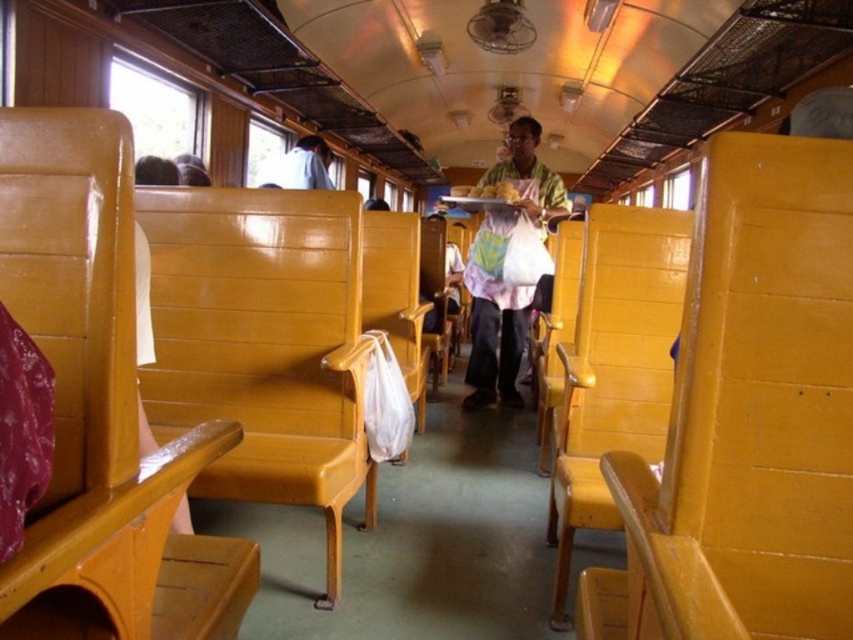
You are a passenger on this vintage train carriage and need to find a place to put your backpack. You see a matte wood chair at left and a matte green shirt at center. Which object has more space available to place your backpack?

The matte green shirt at center has more space available to place your backpack since the matte wood chair at left occupies less space than the matte green shirt at center.

You are a delivery robot with a box that is 7 feet long. You need to place the box between the matte wood chair at center and the matte green shirt at center. Is there enough space between them to fit the box?

The distance between the matte wood chair at center and the matte green shirt at center is 6.87 feet. Since the box is 7 feet long, it will not fit between them as the space is slightly shorter than the box.

You are a passenger in the train carriage and want to sit down on the matte wood chair at left. However, you notice the matte green shirt at center hanging above it. Do you think the chair will still be accessible for sitting?

The matte wood chair at left is shorter than the matte green shirt at center, so the shirt might be hanging low enough to block access to the chair. Check if the shirt can be moved or lifted before sitting.